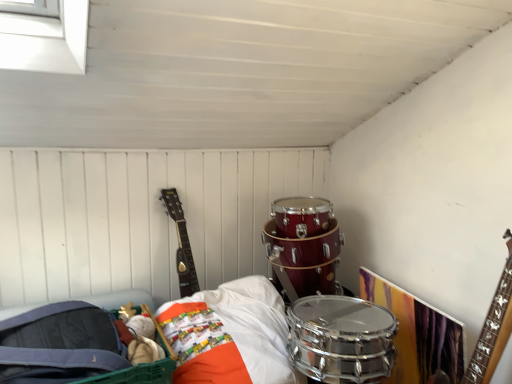
Find the location of a particular element. The image size is (512, 384). matte black guitar at upper left is located at coordinates (181, 244).

What do you see at coordinates (181, 244) in the screenshot? The height and width of the screenshot is (384, 512). I see `matte black guitar at upper left` at bounding box center [181, 244].

What do you see at coordinates (59, 344) in the screenshot? I see `shiny silver drum at lower center` at bounding box center [59, 344].

Where is `shiny silver drum at lower center`? The width and height of the screenshot is (512, 384). shiny silver drum at lower center is located at coordinates (59, 344).

Identify the location of matte black guitar at upper left. Image resolution: width=512 pixels, height=384 pixels. [x=181, y=244].

Which object is positioned more to the left, matte black guitar at upper left or shiny silver drum at lower center?

From the viewer's perspective, shiny silver drum at lower center appears more on the left side.

Does matte black guitar at upper left come in front of shiny silver drum at lower center?

No, matte black guitar at upper left is further to the viewer.

Considering the points (166, 205) and (97, 340), which point is in front, point (166, 205) or point (97, 340)?

Positioned in front is point (97, 340).

From the image's perspective, is matte black guitar at upper left below shiny silver drum at lower center?

No, from the image's perspective, matte black guitar at upper left is not below shiny silver drum at lower center.

From a real-world perspective, who is located lower, matte black guitar at upper left or shiny silver drum at lower center?

shiny silver drum at lower center is physically lower.

Is matte black guitar at upper left wider than shiny silver drum at lower center?

In fact, matte black guitar at upper left might be narrower than shiny silver drum at lower center.

From the picture: Considering the sizes of objects matte black guitar at upper left and shiny silver drum at lower center in the image provided, who is taller, matte black guitar at upper left or shiny silver drum at lower center?

matte black guitar at upper left.

Who is smaller, matte black guitar at upper left or shiny silver drum at lower center?

Smaller between the two is matte black guitar at upper left.

Can shiny silver drum at lower center be found inside matte black guitar at upper left?

That's incorrect, shiny silver drum at lower center is not inside matte black guitar at upper left.

Does matte black guitar at upper left touch shiny silver drum at lower center?

No, matte black guitar at upper left is not with shiny silver drum at lower center.

Is matte black guitar at upper left turned away from shiny silver drum at lower center?

matte black guitar at upper left does not have its back to shiny silver drum at lower center.

How much distance is there between matte black guitar at upper left and shiny silver drum at lower center?

matte black guitar at upper left is 25.02 inches away from shiny silver drum at lower center.

At what (x,y) coordinates should I click in order to perform the action: click on guitar that is above the shiny silver drum at lower center (from the image's perspective). Please return your answer as a coordinate pair (x, y). Looking at the image, I should click on click(x=181, y=244).

Can you confirm if shiny silver drum at lower center is positioned to the left of matte black guitar at upper left?

Correct, you'll find shiny silver drum at lower center to the left of matte black guitar at upper left.

Does shiny silver drum at lower center come in front of matte black guitar at upper left?

Yes, shiny silver drum at lower center is closer to the viewer.

Does point (42, 358) lie behind point (173, 202)?

No, (42, 358) is closer to viewer.

Based on the photo, from the image's perspective, is shiny silver drum at lower center beneath matte black guitar at upper left?

Yes, from the image's perspective, shiny silver drum at lower center is beneath matte black guitar at upper left.

From a real-world perspective, does shiny silver drum at lower center sit lower than matte black guitar at upper left?

Yes.

Considering the relative sizes of shiny silver drum at lower center and matte black guitar at upper left in the image provided, is shiny silver drum at lower center wider than matte black guitar at upper left?

Yes, shiny silver drum at lower center is wider than matte black guitar at upper left.

Which of these two, shiny silver drum at lower center or matte black guitar at upper left, stands shorter?

shiny silver drum at lower center is shorter.

In terms of size, does shiny silver drum at lower center appear bigger or smaller than matte black guitar at upper left?

shiny silver drum at lower center is bigger than matte black guitar at upper left.

Is shiny silver drum at lower center surrounding matte black guitar at upper left?

Actually, matte black guitar at upper left is outside shiny silver drum at lower center.

Is shiny silver drum at lower center next to matte black guitar at upper left and touching it?

They are not placed beside each other.

Could you tell me if shiny silver drum at lower center is facing matte black guitar at upper left?

No.

Can you tell me how much shiny silver drum at lower center and matte black guitar at upper left differ in facing direction?

The angle between the facing direction of shiny silver drum at lower center and the facing direction of matte black guitar at upper left is 0.000482 degrees.

The image size is (512, 384). What are the coordinates of `guitar above the shiny silver drum at lower center (from the image's perspective)` in the screenshot? It's located at coord(181,244).

The width and height of the screenshot is (512, 384). I want to click on drum on the left of the matte black guitar at upper left, so click(59, 344).

You are a GUI agent. You are given a task and a screenshot of the screen. Output one action in this format:
    pyautogui.click(x=<x>, y=<y>)
    Task: Click on the drum below the matte black guitar at upper left (from a real-world perspective)
    
    Given the screenshot: What is the action you would take?
    pyautogui.click(x=59, y=344)